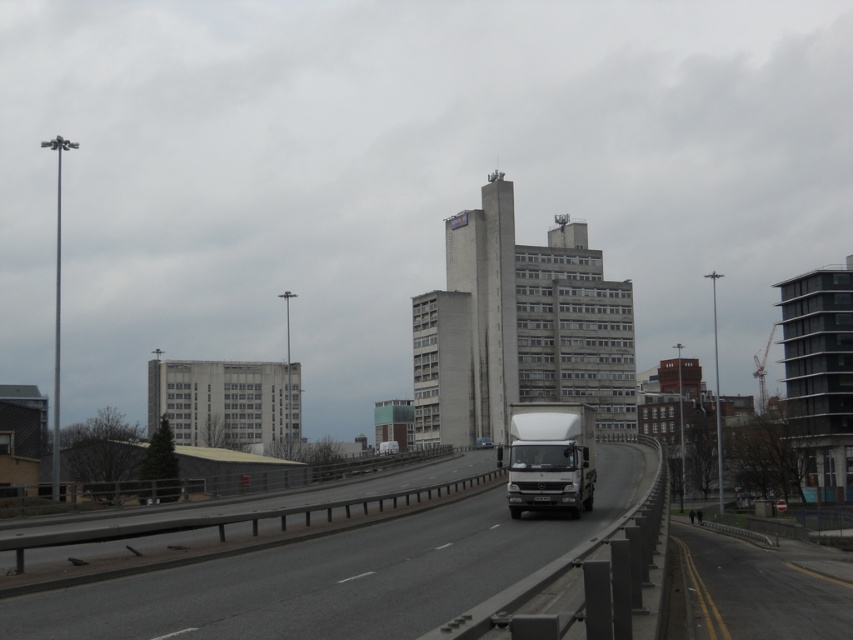
Between white matte trailer truck at center and matte white van at center, which one appears on the right side from the viewer's perspective?

matte white van at center is more to the right.

Can you confirm if white matte trailer truck at center is positioned to the left of matte white van at center?

Yes, white matte trailer truck at center is to the left of matte white van at center.

Does point (566, 448) come in front of point (490, 442)?

Yes, it is.

What are the coordinates of `white matte trailer truck at center` in the screenshot? It's located at (550, 458).

The width and height of the screenshot is (853, 640). What do you see at coordinates (337, 576) in the screenshot?
I see `smooth asphalt highway at center` at bounding box center [337, 576].

Can you confirm if smooth asphalt highway at center is taller than white matte trailer truck at center?

In fact, smooth asphalt highway at center may be shorter than white matte trailer truck at center.

Which is in front, point (306, 602) or point (549, 470)?

Positioned in front is point (306, 602).

This screenshot has height=640, width=853. Identify the location of smooth asphalt highway at center. (337, 576).

Between smooth asphalt highway at center and matte white van at center, which one has less height?

With less height is matte white van at center.

Which is in front, point (175, 579) or point (477, 438)?

Positioned in front is point (175, 579).

This screenshot has height=640, width=853. What do you see at coordinates (337, 576) in the screenshot?
I see `smooth asphalt highway at center` at bounding box center [337, 576].

The image size is (853, 640). Find the location of `smooth asphalt highway at center`. smooth asphalt highway at center is located at coordinates (337, 576).